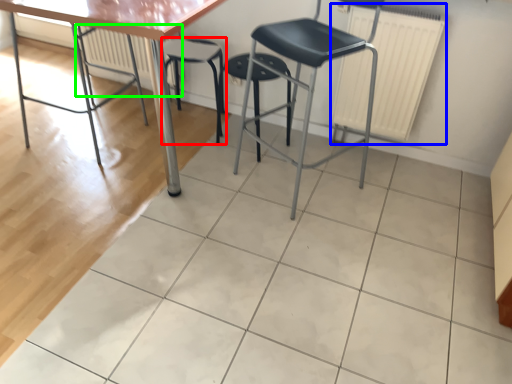
Question: Estimate the real-world distances between objects in this image. Which object is closer to stool (highlighted by a red box), radiator (highlighted by a blue box) or radiator (highlighted by a green box)?

Choices:
 (A) radiator
 (B) radiator

Answer: (B)